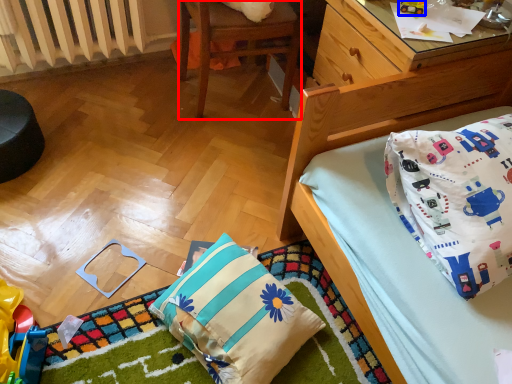
Question: Which of the following is the farthest to the observer, chair (highlighted by a red box) or toy (highlighted by a blue box)?

Choices:
 (A) chair
 (B) toy

Answer: (A)